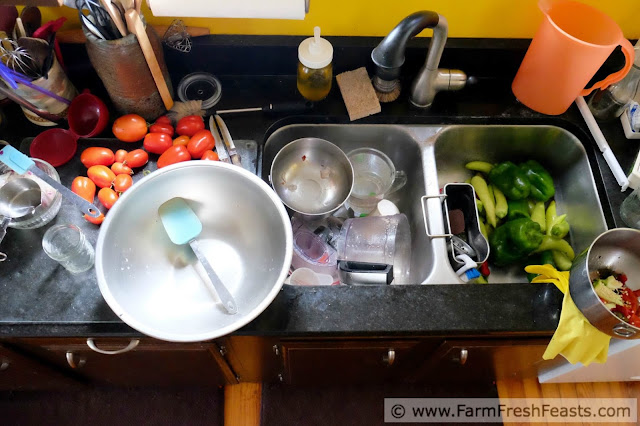
Locate an element on the screen. Image resolution: width=640 pixels, height=426 pixels. dirty dishes is located at coordinates (349, 214).